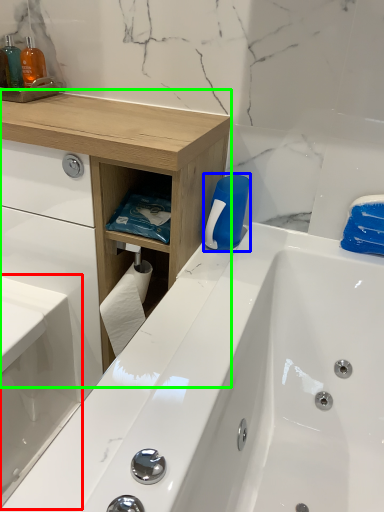
Question: Considering the real-world distances, which object is farthest from sink (highlighted by a red box)? cleaning product (highlighted by a blue box) or counter (highlighted by a green box)?

Choices:
 (A) cleaning product
 (B) counter

Answer: (A)